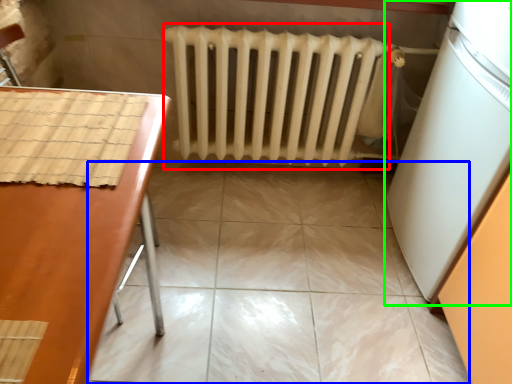
Question: Considering the real-world distances, which object is farthest from radiator (highlighted by a red box)? ceramic tile (highlighted by a blue box) or appliance (highlighted by a green box)?

Choices:
 (A) ceramic tile
 (B) appliance

Answer: (B)